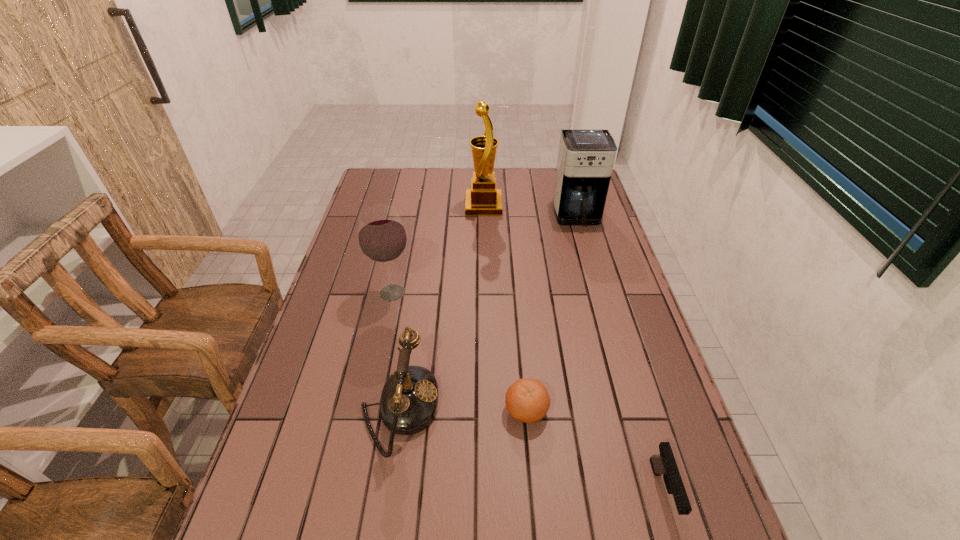
The image size is (960, 540). What are the coordinates of `award` in the screenshot? It's located at (483, 199).

What are the coordinates of `coffee maker` in the screenshot? It's located at (585, 161).

Locate an element on the screen. alcohol is located at coordinates (382, 238).

You are a GUI agent. You are given a task and a screenshot of the screen. Output one action in this format:
    pyautogui.click(x=<x>, y=<y>)
    Task: Click on the third shortest object
    This screenshot has width=960, height=540.
    Given the screenshot: What is the action you would take?
    pyautogui.click(x=409, y=399)

You are a GUI agent. You are given a task and a screenshot of the screen. Output one action in this format:
    pyautogui.click(x=<x>, y=<y>)
    Task: Click on the pistol
    This screenshot has height=540, width=960.
    Given the screenshot: What is the action you would take?
    pyautogui.click(x=664, y=464)

Where is `clementine`? The width and height of the screenshot is (960, 540). clementine is located at coordinates (527, 400).

Image resolution: width=960 pixels, height=540 pixels. I want to click on vacant space located 0.280m on the front-facing side of the award, so click(x=393, y=206).

Image resolution: width=960 pixels, height=540 pixels. Find the location of `vacant region located 0.280m on the front-facing side of the award`. vacant region located 0.280m on the front-facing side of the award is located at coordinates (393, 206).

Locate an element on the screen. The image size is (960, 540). vacant space located 0.070m on the front-facing side of the award is located at coordinates (447, 206).

Locate an element on the screen. This screenshot has width=960, height=540. free space located on the front panel of the coffee maker is located at coordinates (600, 295).